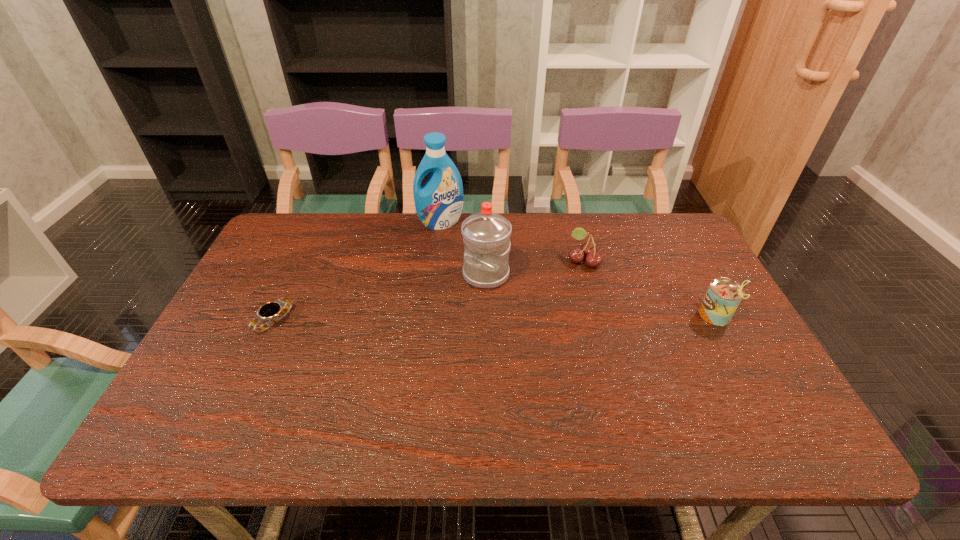
Where is `vacant spot on the desktop that is between the leftmost object and the can and is positioned on the front-facing side of the fourth object from right to left`? vacant spot on the desktop that is between the leftmost object and the can and is positioned on the front-facing side of the fourth object from right to left is located at coordinates (460, 319).

Identify the location of vacant space on the desktop that is between the watch and the can and is positioned on the leaves of the second object from right to left. (477, 319).

The image size is (960, 540). Find the location of `free spot on the desktop that is between the shortest object and the third tallest object and is positioned on the handle side of the third object from left to right`. free spot on the desktop that is between the shortest object and the third tallest object and is positioned on the handle side of the third object from left to right is located at coordinates (444, 319).